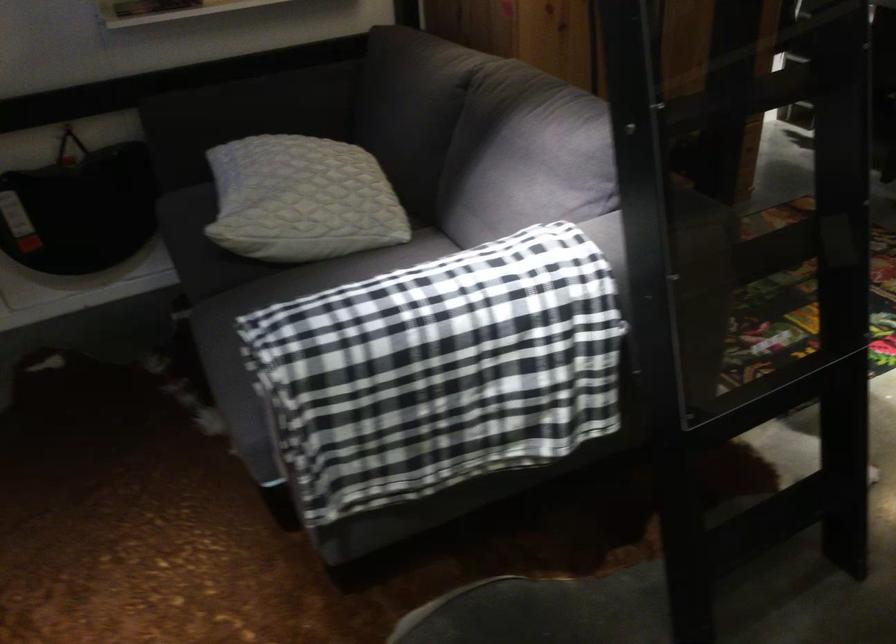
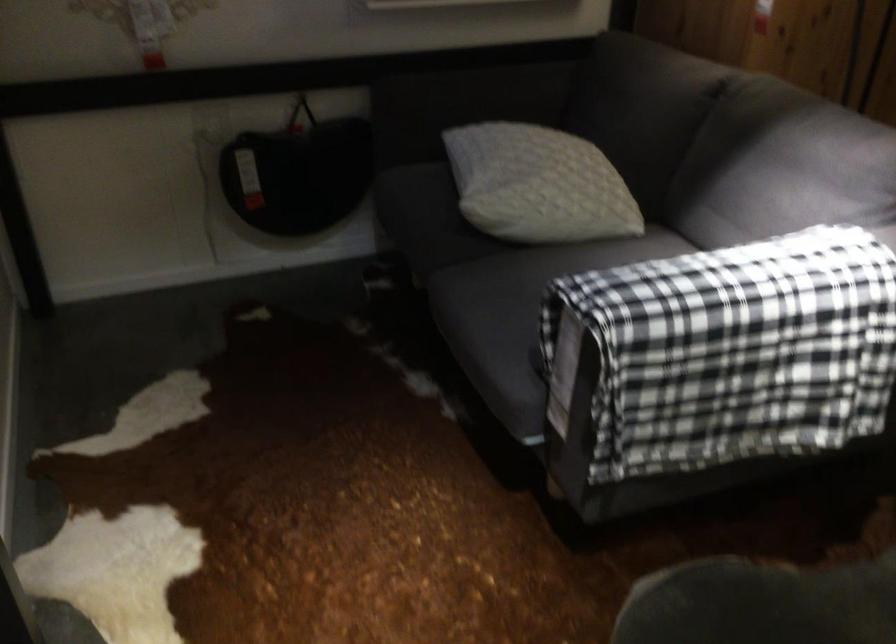
Find the pixel in the second image that matches point 255,111 in the first image.

(478, 98)